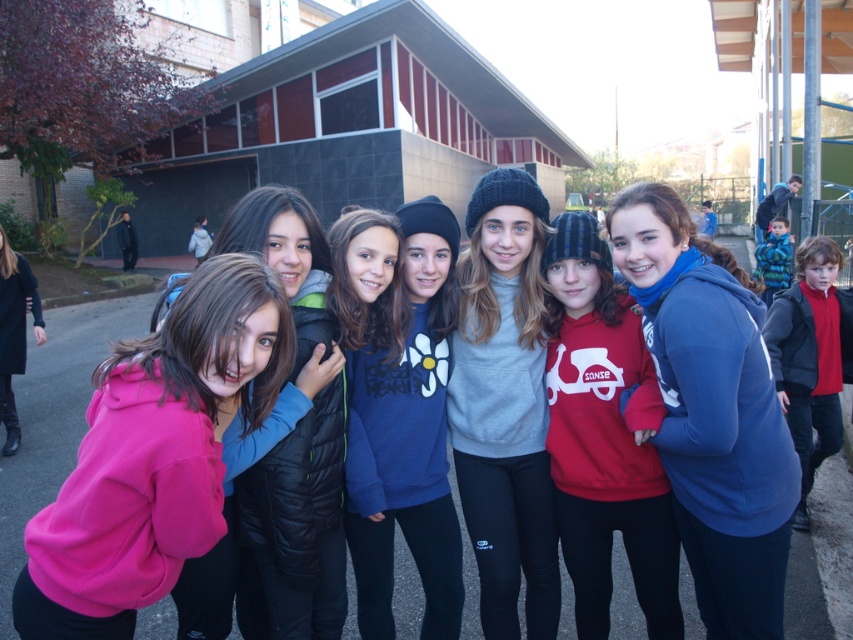
You are standing in the schoolyard looking at the group of seven people. There is a point marked at coordinates (503, 404). Which object does this point correspond to?

The point at coordinates (503, 404) corresponds to the gray knit beanie at center.

In the scene shown: You are a photographer standing 10 feet away from the camera. You want to take a photo of the blue fleece jacket at center. Can you reach the jacket without moving the camera?

The blue fleece jacket at center and camera are 7.02 feet apart. Since you are 10 feet away from the camera, the total distance between you and the jacket is 17.02 feet. Most standard cameras have a maximum focus distance of around 100 feet, so you should be able to take a photo of the blue fleece jacket at center without moving the camera.